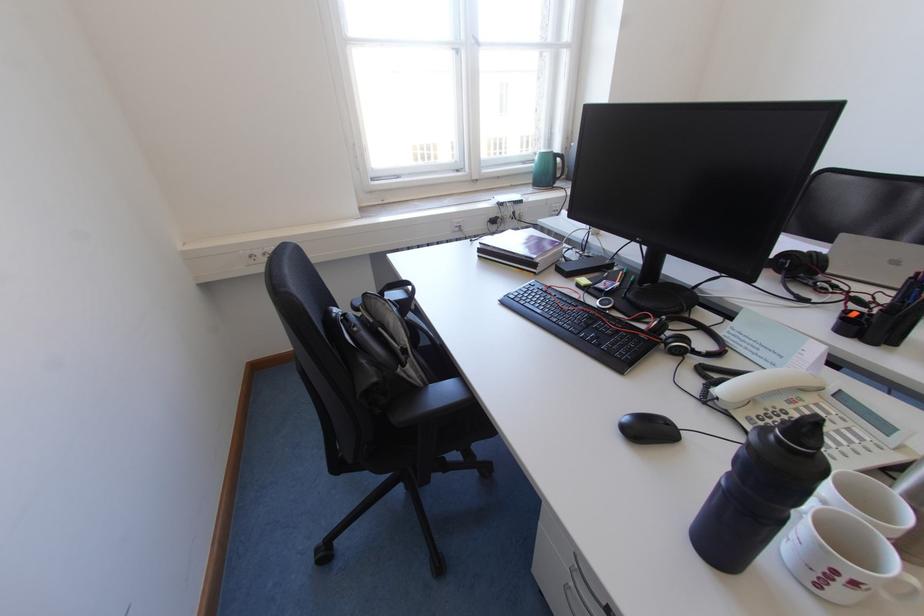
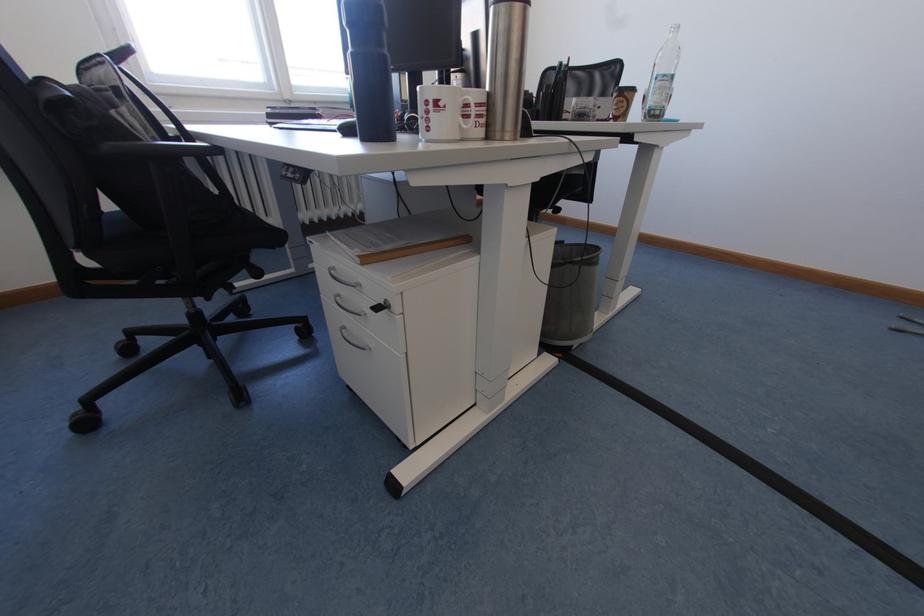
Question: The first image is from the beginning of the video and the second image is from the end. How did the camera likely rotate when shooting the video?

Choices:
 (A) Left
 (B) Right
 (C) Up
 (D) Down

Answer: (B)